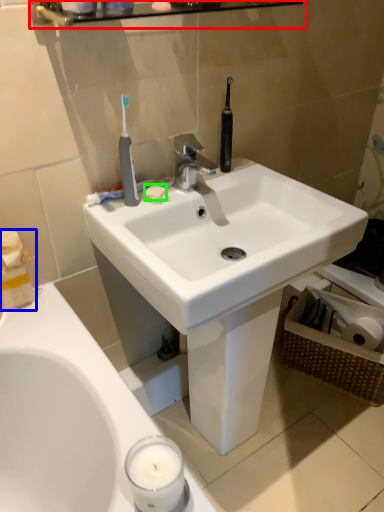
Question: Estimate the real-world distances between objects in this image. Which object is closer to balustrade (highlighted by a red box), tissue (highlighted by a blue box) or soap (highlighted by a green box)?

Choices:
 (A) tissue
 (B) soap

Answer: (B)